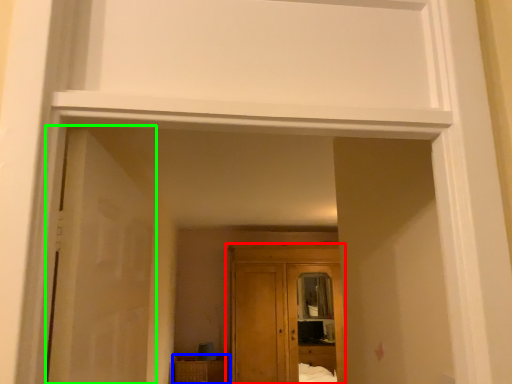
Question: Which object is positioned closest to cupboard (highlighted by a red box)? Select from cabinetry (highlighted by a blue box) and door (highlighted by a green box).

Choices:
 (A) cabinetry
 (B) door

Answer: (A)